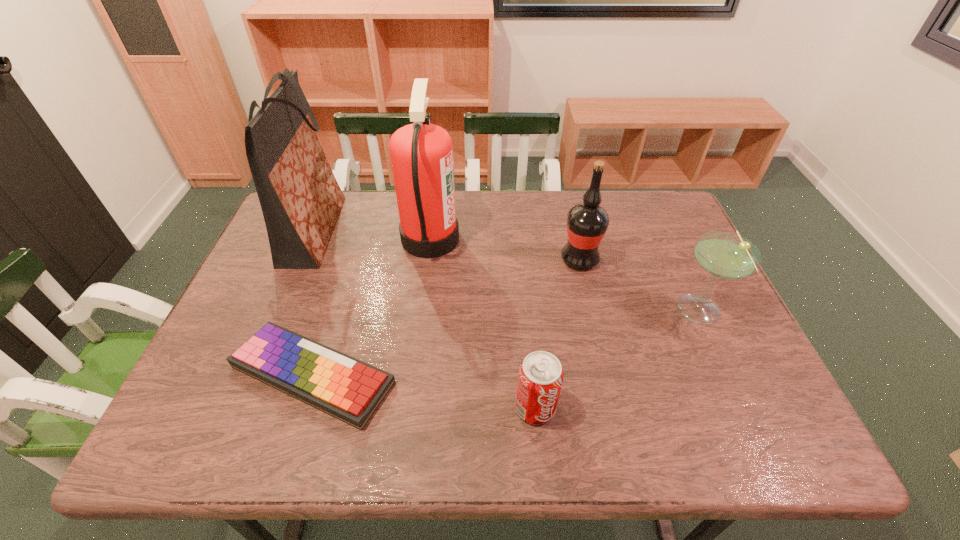
The width and height of the screenshot is (960, 540). What are the coordinates of `free space located 0.100m at the nozzle of the fire extinguisher` in the screenshot? It's located at (492, 239).

The width and height of the screenshot is (960, 540). I want to click on vacant space situated 0.050m on the front of the second object from right to left, so click(x=586, y=286).

The width and height of the screenshot is (960, 540). I want to click on vacant point located 0.180m on the left of the martini, so click(x=603, y=312).

Where is `vacant space located on the left of the soda can`? vacant space located on the left of the soda can is located at coordinates 473,408.

Find the location of a particular element. free location located 0.110m on the back of the computer keyboard is located at coordinates (337, 295).

The height and width of the screenshot is (540, 960). Identify the location of shopping bag situated at the far edge. (300, 198).

The width and height of the screenshot is (960, 540). Identify the location of fire extinguisher that is positioned at the far edge. click(x=421, y=154).

The height and width of the screenshot is (540, 960). I want to click on soda can that is at the near edge, so click(x=540, y=377).

Image resolution: width=960 pixels, height=540 pixels. In order to click on computer keyboard positioned at the near edge in this screenshot , I will do `click(350, 390)`.

At what (x,y) coordinates should I click in order to perform the action: click on shopping bag positioned at the left edge. Please return your answer as a coordinate pair (x, y). The image size is (960, 540). Looking at the image, I should click on (300, 198).